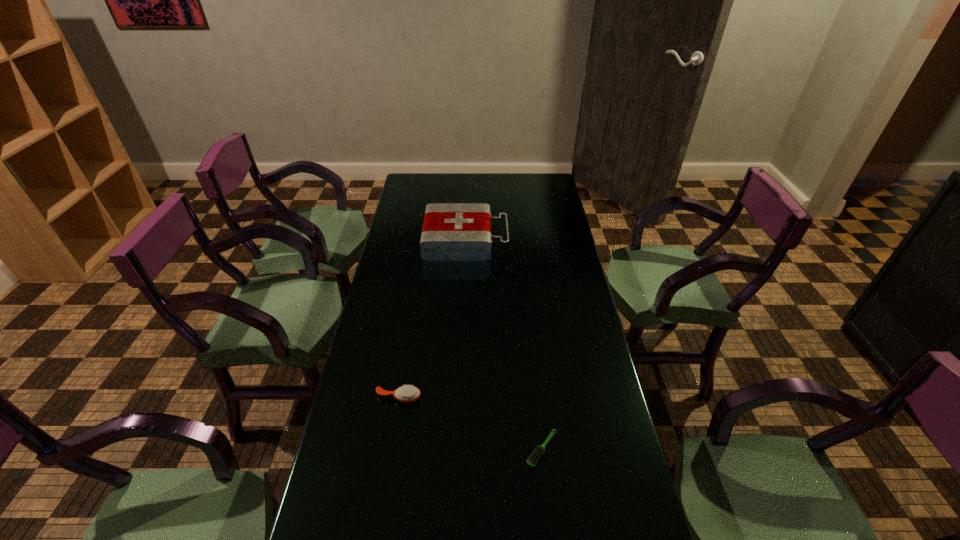
Identify the location of the first-aid kit. (451, 231).

This screenshot has width=960, height=540. I want to click on the farthest object, so click(451, 231).

The width and height of the screenshot is (960, 540). Find the location of `the second nearest object`. the second nearest object is located at coordinates (x=407, y=394).

Identify the location of the farther hairbrush. The height and width of the screenshot is (540, 960). (407, 394).

This screenshot has height=540, width=960. I want to click on the shorter hairbrush, so click(533, 458).

Identify the location of the nearest object. This screenshot has height=540, width=960. (533, 458).

The height and width of the screenshot is (540, 960). Identify the location of vacant space situated on the front side of the first-aid kit. (558, 240).

You are a GUI agent. You are given a task and a screenshot of the screen. Output one action in this format:
    pyautogui.click(x=<x>, y=<y>)
    Task: Click on the free space located on the front of the left hairbrush
    The height and width of the screenshot is (540, 960).
    Given the screenshot: What is the action you would take?
    pyautogui.click(x=393, y=431)

Image resolution: width=960 pixels, height=540 pixels. I want to click on vacant region located 0.210m on the left of the rightmost object, so click(444, 449).

Image resolution: width=960 pixels, height=540 pixels. Identify the location of the first-aid kit positioned at the left edge. (451, 231).